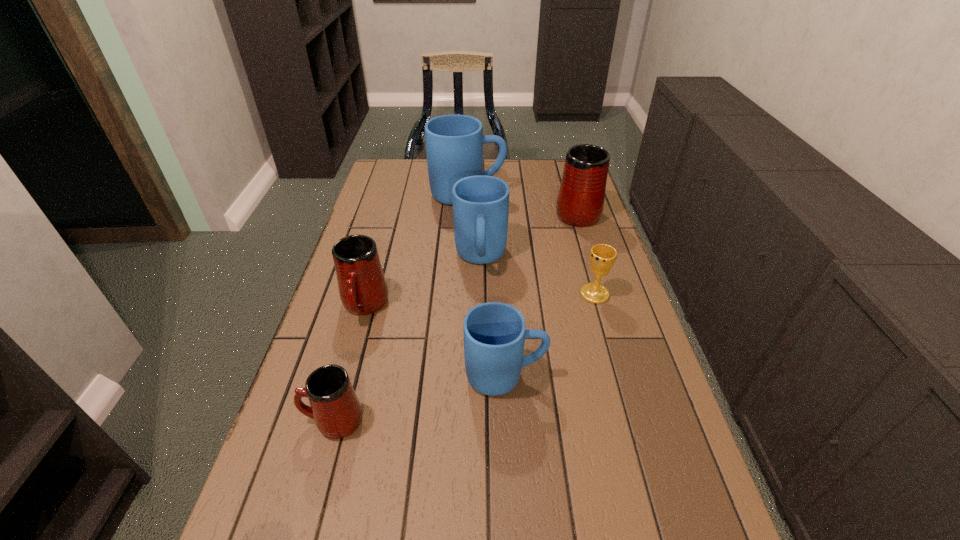
You are a GUI agent. You are given a task and a screenshot of the screen. Output one action in this format:
    pyautogui.click(x=<x>, y=<y>)
    Task: Click on the empty space between the third nearest mug and the fifth nearest object
    Image resolution: width=960 pixels, height=540 pixels.
    Given the screenshot: What is the action you would take?
    pyautogui.click(x=422, y=282)

I want to click on vacant area between the chalice and the farthest red mug, so click(x=586, y=253).

I want to click on the sixth closest object to the shortest mug, so click(x=580, y=202).

Select which object appears as the closest to the farthest red mug. Please provide its 2D coordinates. Your answer should be formatted as a tuple, i.e. [(x, y)], where the tuple contains the x and y coordinates of a point satisfying the conditions above.

[(454, 143)]

Point out which mug is positioned as the fifth nearest to the second farthest red mug. Please provide its 2D coordinates. Your answer should be formatted as a tuple, i.e. [(x, y)], where the tuple contains the x and y coordinates of a point satisfying the conditions above.

[(580, 202)]

Locate which mug is the third closest to the nearest blue mug. Please provide its 2D coordinates. Your answer should be formatted as a tuple, i.e. [(x, y)], where the tuple contains the x and y coordinates of a point satisfying the conditions above.

[(480, 203)]

Where is `blue mug that is the second closest to the farthest blue mug`? blue mug that is the second closest to the farthest blue mug is located at coordinates (494, 333).

Identify the location of blue mug that is the second closest to the second nearest object. The height and width of the screenshot is (540, 960). (454, 143).

Locate which red mug ranks second in proximity to the second nearest red mug. Please provide its 2D coordinates. Your answer should be formatted as a tuple, i.e. [(x, y)], where the tuple contains the x and y coordinates of a point satisfying the conditions above.

[(580, 202)]

I want to click on red mug that stands as the closest to the gold chalice, so click(580, 202).